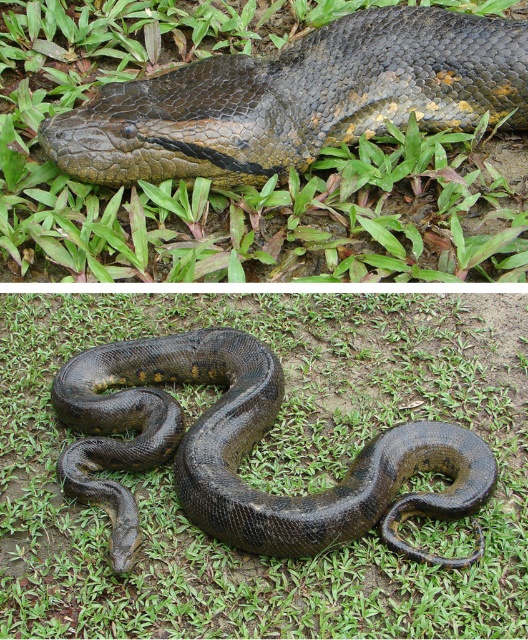
Question: Which object appears farthest from the camera in this image?

Choices:
 (A) shiny dark green snake at upper center
 (B) shiny dark green snake at center

Answer: (A)

Question: Is shiny dark green snake at upper center closer to the viewer compared to shiny dark green snake at center?

Choices:
 (A) no
 (B) yes

Answer: (A)

Question: Which object appears farthest from the camera in this image?

Choices:
 (A) shiny dark green snake at upper center
 (B) shiny dark green snake at center

Answer: (A)

Question: Is the position of shiny dark green snake at upper center more distant than that of shiny dark green snake at center?

Choices:
 (A) no
 (B) yes

Answer: (B)

Question: Which of the following is the farthest from the observer?

Choices:
 (A) shiny dark green snake at upper center
 (B) shiny dark green snake at center

Answer: (A)

Question: Is shiny dark green snake at upper center positioned in front of shiny dark green snake at center?

Choices:
 (A) yes
 (B) no

Answer: (B)